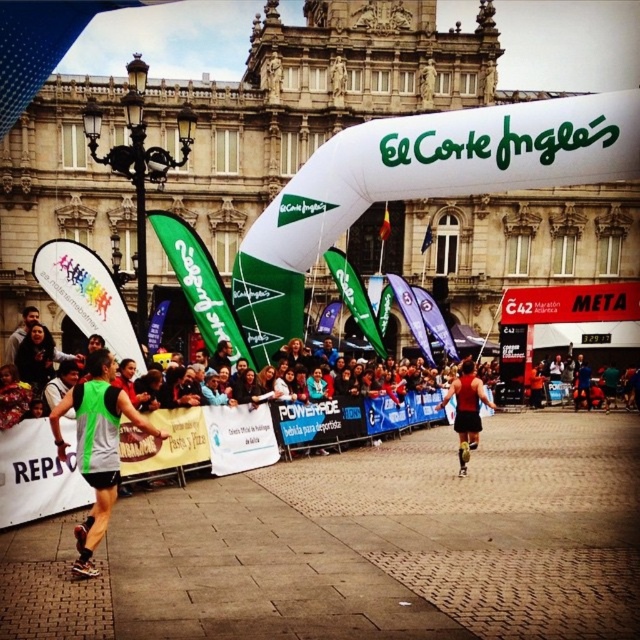
What is located at the coordinates point [97,445]?

A green fabric vest at left is located at point [97,445].

You are a photographer at the marathon finish line. You need to capture a photo that includes both the green fabric vest at left and the red matte tank top at center. Which clothing item will appear bigger in the photo?

The green fabric vest at left will appear bigger in the photo because it is larger in size than the red matte tank top at center.

You are a photographer at the marathon finish line. You want to take a photo that includes both the green fabric vest at left and the red matte tank top at center. Which runner should you focus on first to ensure both are in the frame?

You should focus on the green fabric vest at left first because it is in front of the red matte tank top at center, so capturing the foreground runner first ensures both will be visible in the frame.